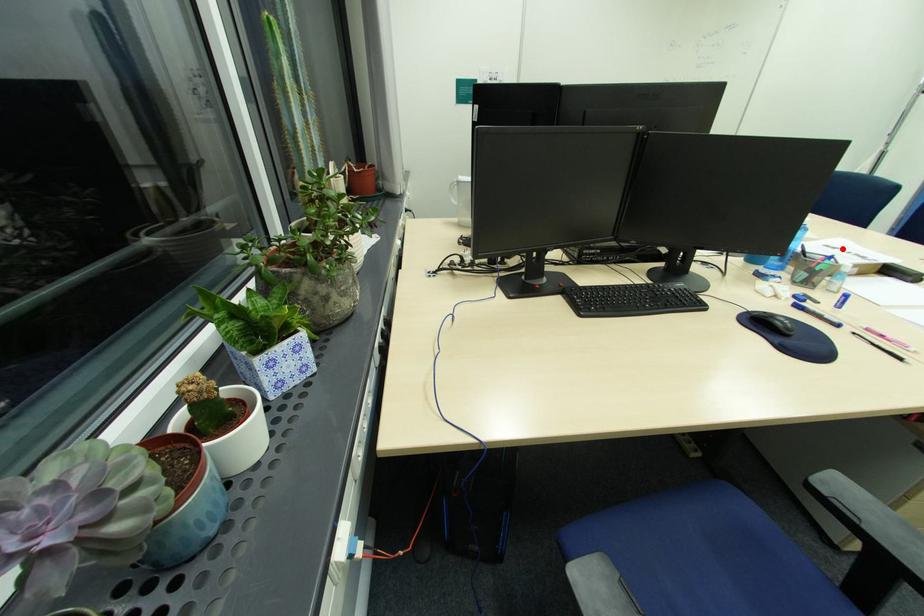
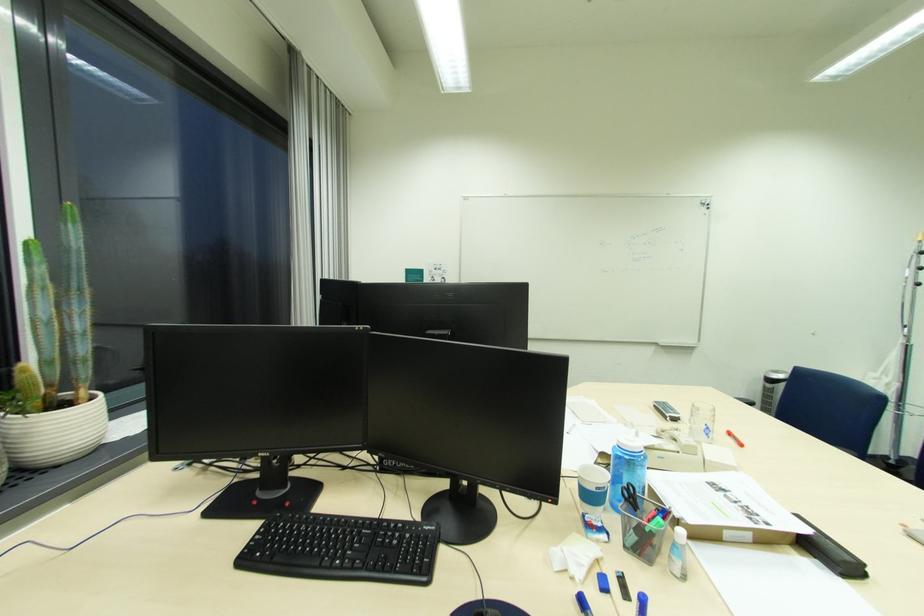
Locate, in the second image, the point that corresponds to the highlighted location in the first image.

(731, 491)